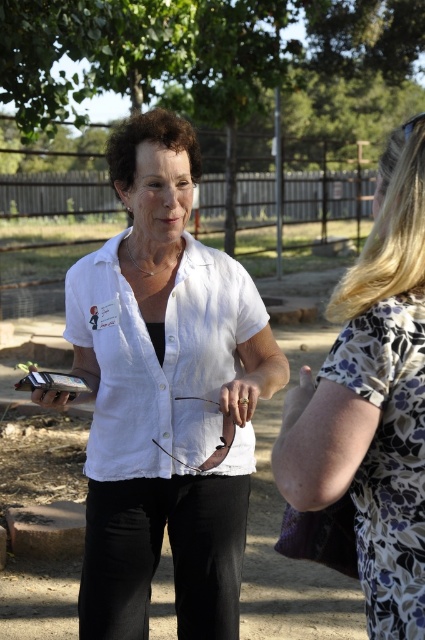
The height and width of the screenshot is (640, 425). Describe the element at coordinates (373, 401) in the screenshot. I see `floral fabric dress at center` at that location.

Where is `floral fabric dress at center`? floral fabric dress at center is located at coordinates (373, 401).

Image resolution: width=425 pixels, height=640 pixels. What are the coordinates of `white matte shirt at center` in the screenshot? It's located at (164, 396).

Between point (127, 500) and point (379, 212), which one is positioned in front?

Point (379, 212) is more forward.

Image resolution: width=425 pixels, height=640 pixels. Identify the location of white matte shirt at center. [164, 396].

Identify the location of white matte shirt at center. The image size is (425, 640). (164, 396).

Is white matte shirt at center closer to camera compared to white linen shirt at center?

Yes.

Is white matte shirt at center above white linen shirt at center?

Incorrect, white matte shirt at center is not positioned above white linen shirt at center.

Between point (138, 624) and point (193, 268), which one is positioned behind?

Positioned behind is point (193, 268).

Where is `white matte shirt at center`? This screenshot has height=640, width=425. white matte shirt at center is located at coordinates (164, 396).